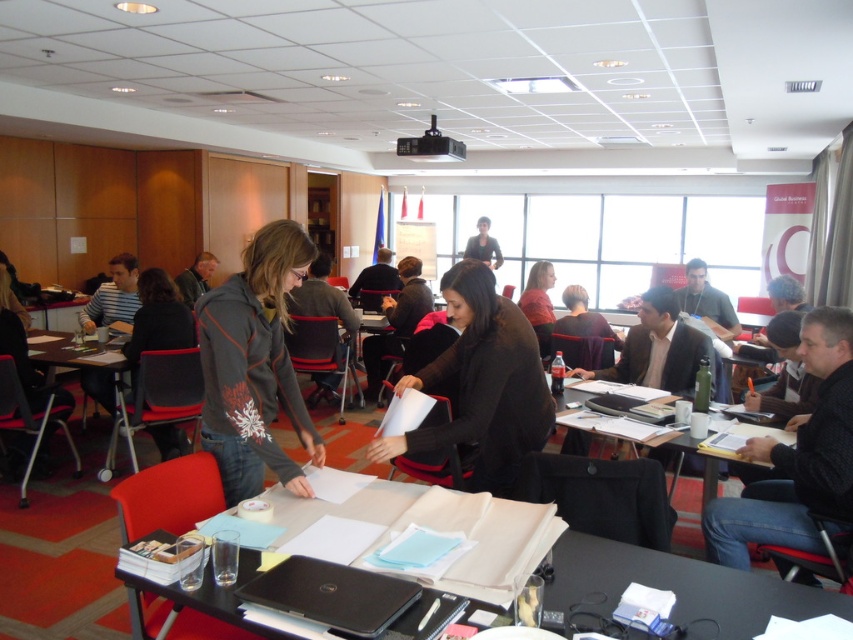
What do you see at coordinates (254, 365) in the screenshot?
I see `dark gray hoodie at center` at bounding box center [254, 365].

Is point (241, 408) in front of point (131, 464)?

Yes, it is in front of point (131, 464).

Who is more distant from viewer, (300, 260) or (35, 332)?

Positioned behind is point (35, 332).

Identify the location of dark gray hoodie at center. (254, 365).

Is black matte jacket at center wider than black plastic table at center?

No.

Does black matte jacket at center appear on the right side of black plastic table at center?

No, black matte jacket at center is not to the right of black plastic table at center.

Between point (389, 456) and point (596, 582), which one is positioned in front?

Positioned in front is point (596, 582).

This screenshot has height=640, width=853. Identify the location of black matte jacket at center. (480, 385).

Find the location of a particular element. This screenshot has width=853, height=640. black plastic table at center is located at coordinates (679, 586).

Is point (572, 605) more distant than point (64, 342)?

That is False.

The image size is (853, 640). Identify the location of black plastic table at center. (679, 586).